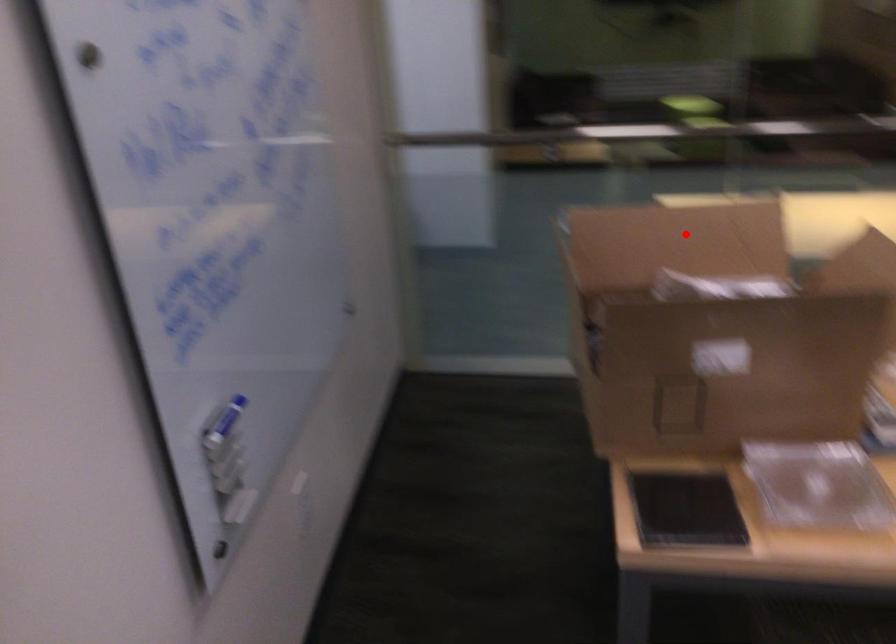
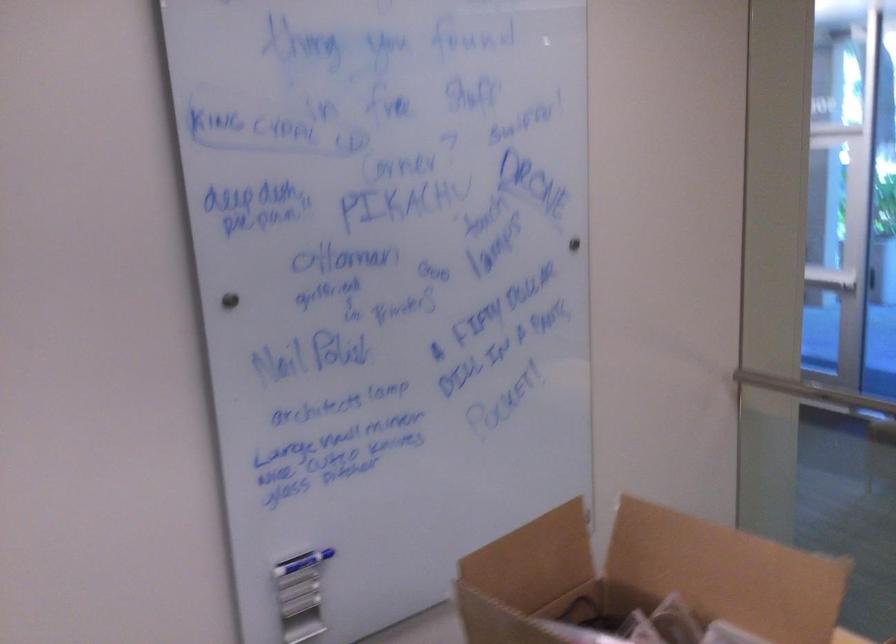
Question: A red point is marked in image1. In image2, is the corresponding 3D point closer to the camera or farther? Reply with the corresponding letter.

Choices:
 (A) The corresponding 3D point is closer.
 (B) The corresponding 3D point is farther.

Answer: (A)